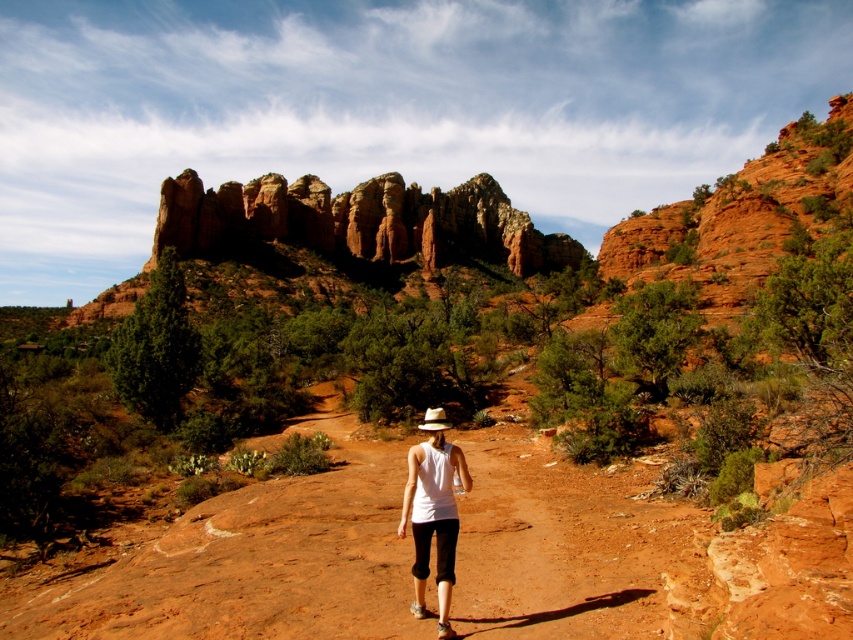
Between rustic sandstone rock formation at upper center and white fabric shirt at center, which one is positioned lower?

Positioned lower is white fabric shirt at center.

Which is more to the left, rustic sandstone rock formation at upper center or white fabric shirt at center?

Positioned to the left is rustic sandstone rock formation at upper center.

Is point (502, 236) closer to viewer compared to point (426, 577)?

No, it is behind (426, 577).

I want to click on rustic sandstone rock formation at upper center, so (x=358, y=221).

Who is more forward, (583, 492) or (460, 220)?

Positioned in front is point (583, 492).

Image resolution: width=853 pixels, height=640 pixels. What do you see at coordinates (248, 560) in the screenshot? I see `dusty red dirt track at center` at bounding box center [248, 560].

Which is in front, point (120, 627) or point (552, 257)?

Positioned in front is point (120, 627).

At what (x,y) coordinates should I click in order to perform the action: click on dusty red dirt track at center. Please return your answer as a coordinate pair (x, y). The image size is (853, 640). Looking at the image, I should click on (248, 560).

Who is more forward, (178, 577) or (440, 442)?

Point (178, 577) is more forward.

Which is behind, point (144, 602) or point (416, 524)?

The point (416, 524) is more distant.

Which is behind, point (180, 566) or point (439, 486)?

Point (180, 566)

The width and height of the screenshot is (853, 640). Find the location of `dusty red dirt track at center`. dusty red dirt track at center is located at coordinates (248, 560).